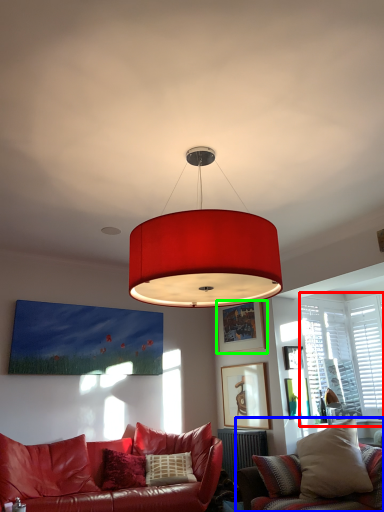
Question: Based on their relative distances, which object is nearer to window (highlighted by a red box)? Choose from studio couch (highlighted by a blue box) and picture frame (highlighted by a green box).

Choices:
 (A) studio couch
 (B) picture frame

Answer: (B)